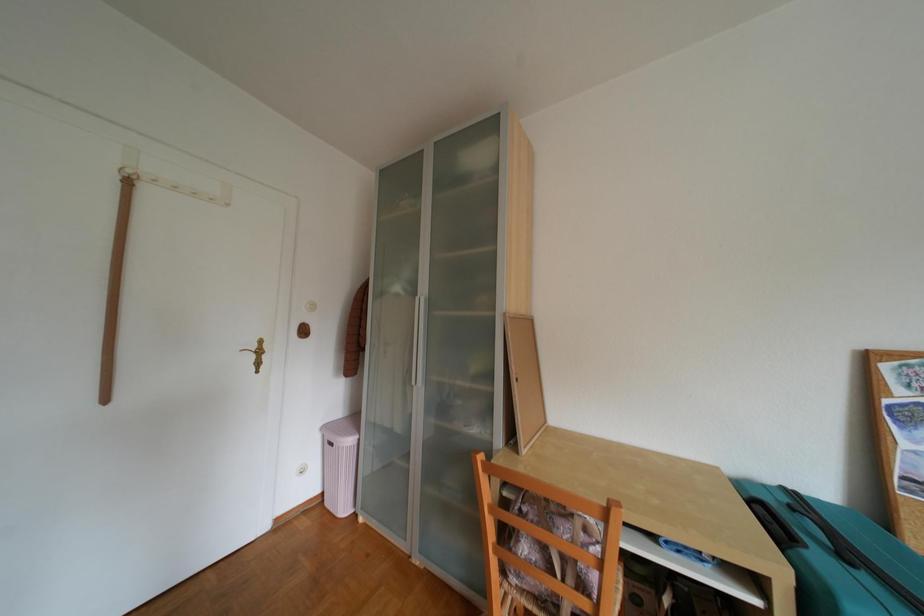
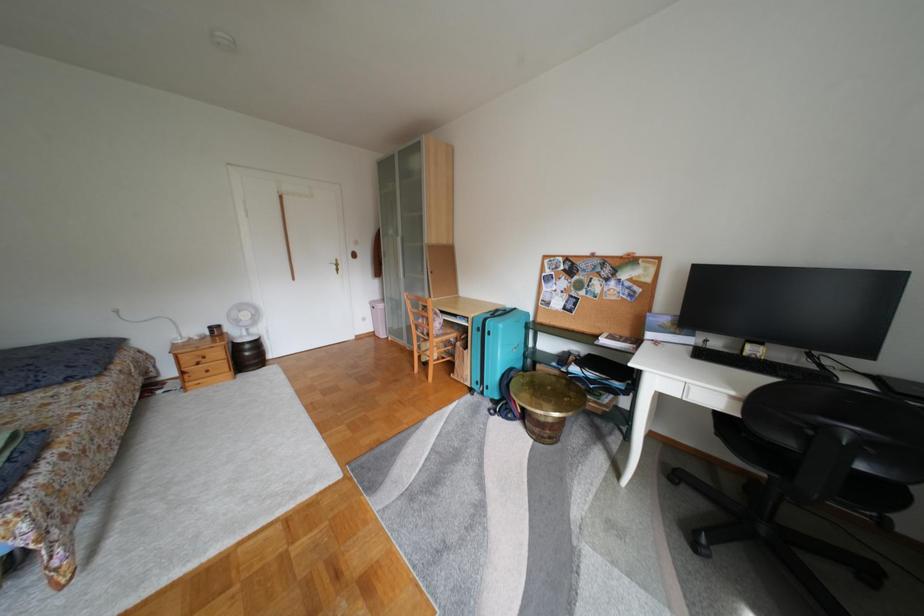
What movement of the cameraman would produce the second image?

The cameraman walked toward right, backward.